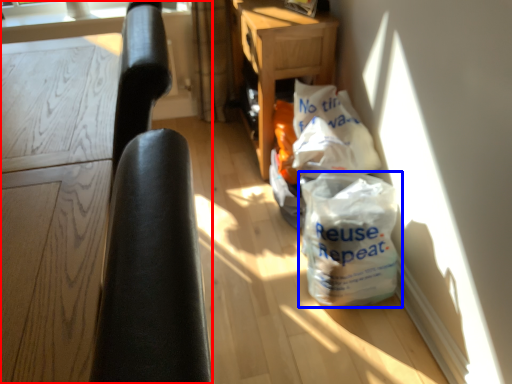
Question: Which of the following is the closest to the observer, furniture (highlighted by a red box) or plastic bag (highlighted by a blue box)?

Choices:
 (A) furniture
 (B) plastic bag

Answer: (A)